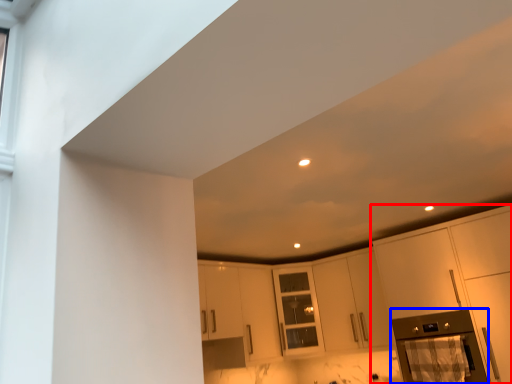
Question: Which object appears closest to the camera in this image, cabinetry (highlighted by a red box) or appliance (highlighted by a blue box)?

Choices:
 (A) cabinetry
 (B) appliance

Answer: (A)